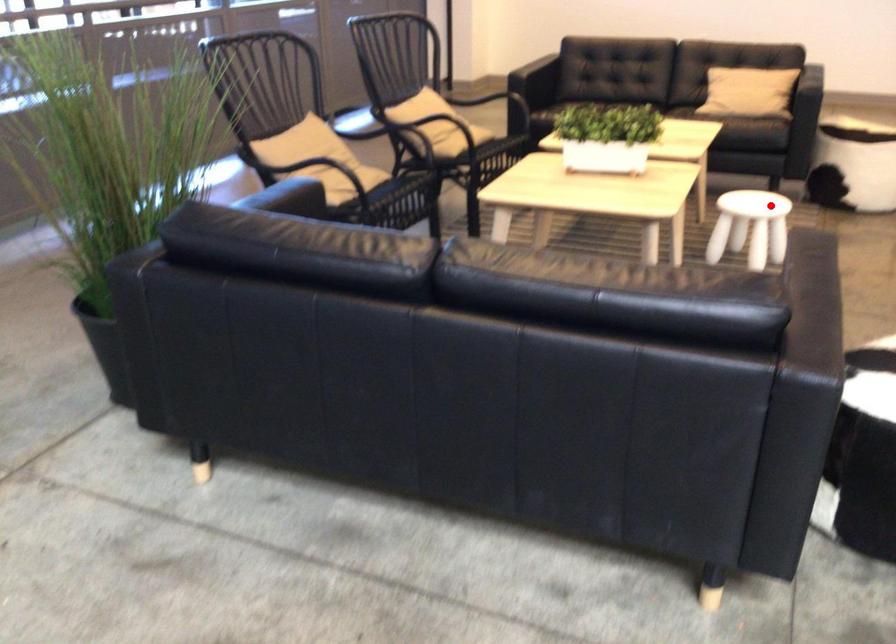
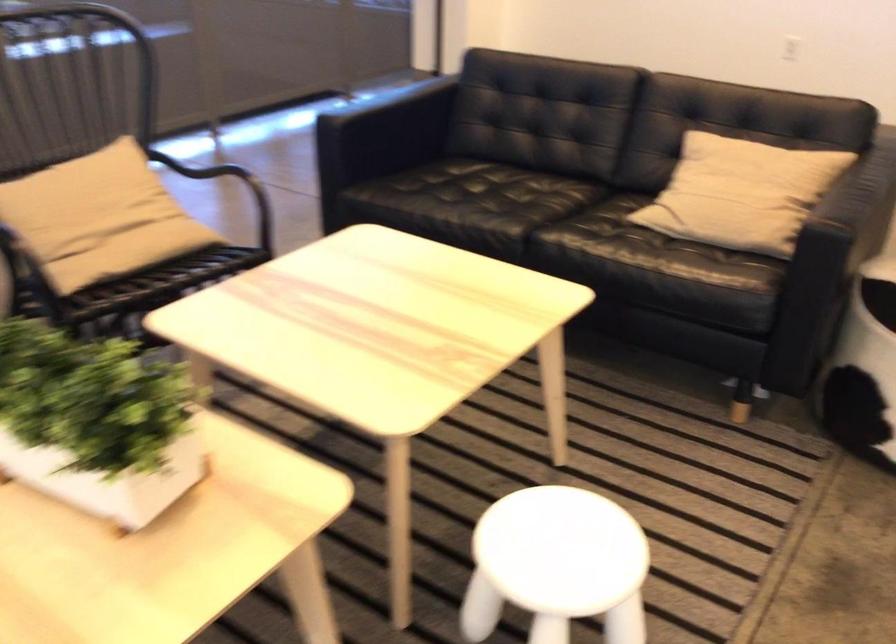
Question: A red point is marked in image1. In image2, is the corresponding 3D point closer to the camera or farther? Reply with the corresponding letter.

Choices:
 (A) The corresponding 3D point is closer.
 (B) The corresponding 3D point is farther.

Answer: (A)